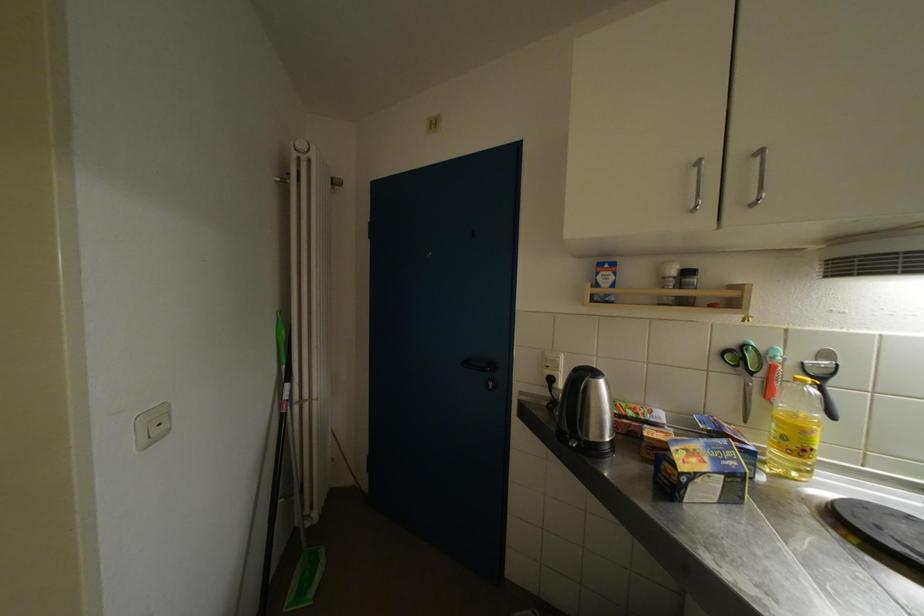
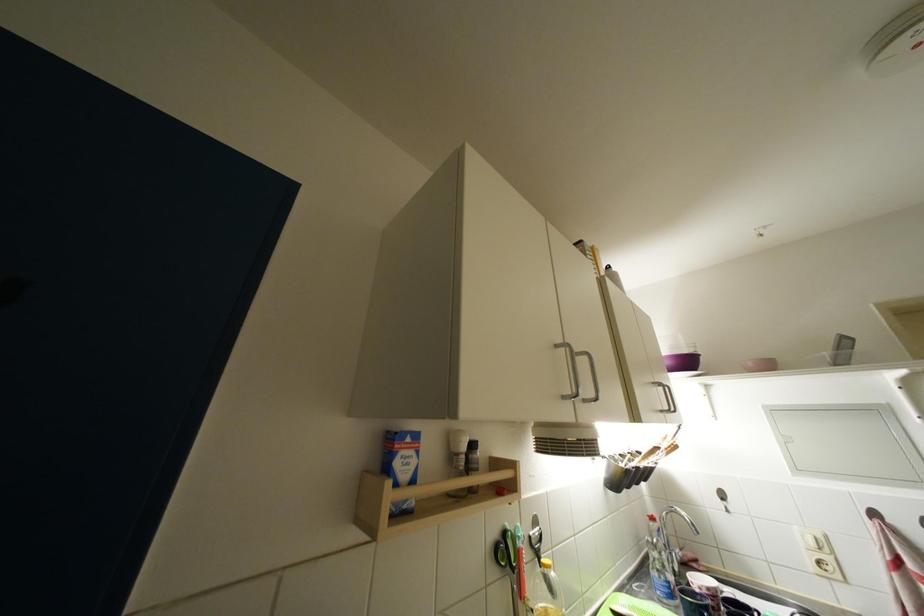
In the second image, find the point that corresponds to (671,282) in the first image.

(464, 458)